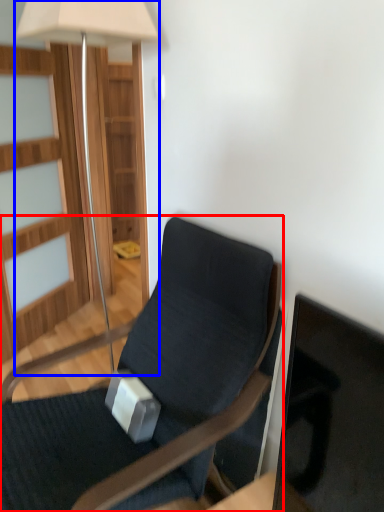
Question: Which object appears closest to the camera in this image, chair (highlighted by a red box) or lamp (highlighted by a blue box)?

Choices:
 (A) chair
 (B) lamp

Answer: (A)